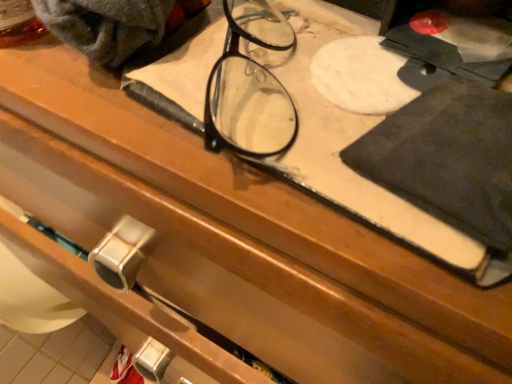
The image size is (512, 384). What do you see at coordinates (249, 89) in the screenshot?
I see `black plastic glasses at center` at bounding box center [249, 89].

Find the location of a particular element. Image resolution: width=512 pixels, height=384 pixels. black plastic glasses at center is located at coordinates (249, 89).

At what (x,y) coordinates should I click in order to perform the action: click on black plastic glasses at center. Please return your answer as a coordinate pair (x, y). This screenshot has height=384, width=512. Looking at the image, I should click on (249, 89).